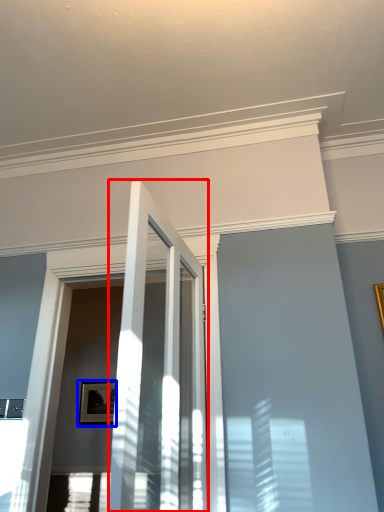
Question: Which of the following is the farthest to the observer, door (highlighted by a red box) or picture frame (highlighted by a blue box)?

Choices:
 (A) door
 (B) picture frame

Answer: (B)